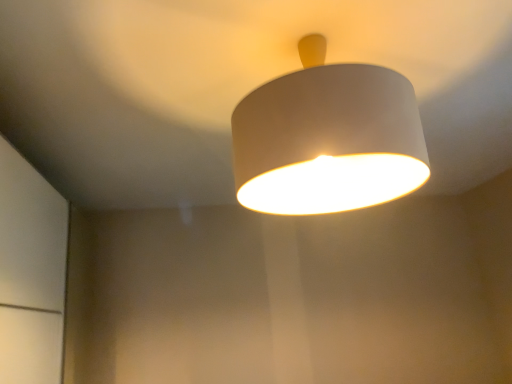
What do you see at coordinates (328, 138) in the screenshot? I see `white matte lampshade at upper center` at bounding box center [328, 138].

The image size is (512, 384). Find the location of `white matte lampshade at upper center`. white matte lampshade at upper center is located at coordinates (328, 138).

I want to click on white matte lampshade at upper center, so click(328, 138).